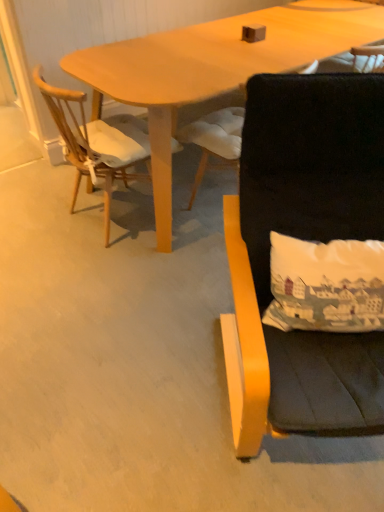
Identify the location of unoccupied area in front of wooden chair at left, which is counted as the third chair, starting from the right. (110, 272).